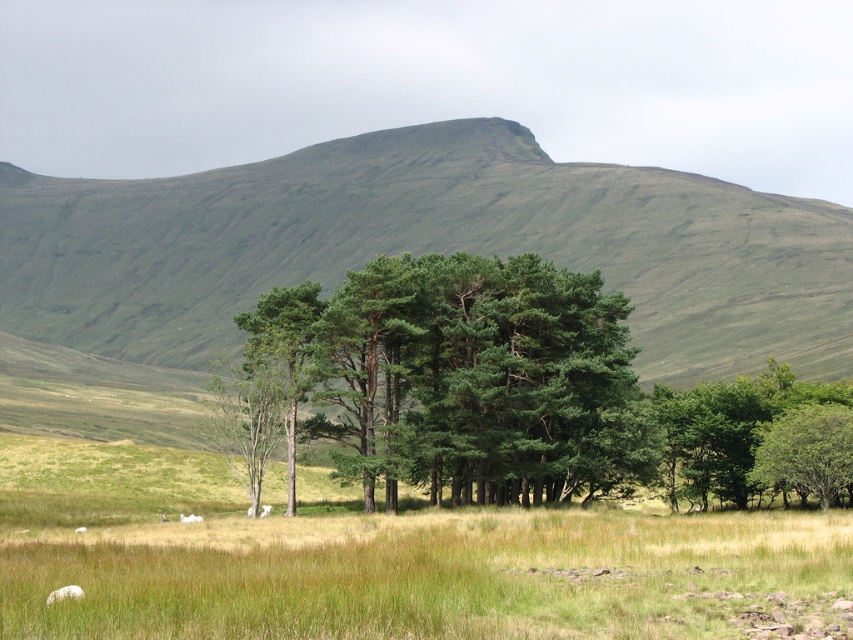
Question: Which object is the farthest from the green matte trees at center?

Choices:
 (A) green leafy trees at right
 (B) green grassy hill at center
 (C) white woolly sheep at lower left

Answer: (B)

Question: Considering the real-world distances, which object is closest to the white woolly sheep at lower left?

Choices:
 (A) green matte trees at center
 (B) green leafy trees at right

Answer: (A)

Question: Does green grassy hill at center come in front of green leafy trees at right?

Choices:
 (A) no
 (B) yes

Answer: (A)

Question: Does green matte trees at center appear on the right side of white woolly sheep at lower left?

Choices:
 (A) no
 (B) yes

Answer: (B)

Question: In this image, where is green grassy hill at center located relative to green leafy trees at right?

Choices:
 (A) right
 (B) left

Answer: (B)

Question: Based on their relative distances, which object is farther from the green grassy hill at center?

Choices:
 (A) white woolly sheep at lower left
 (B) green matte trees at center
 (C) green leafy trees at right

Answer: (A)